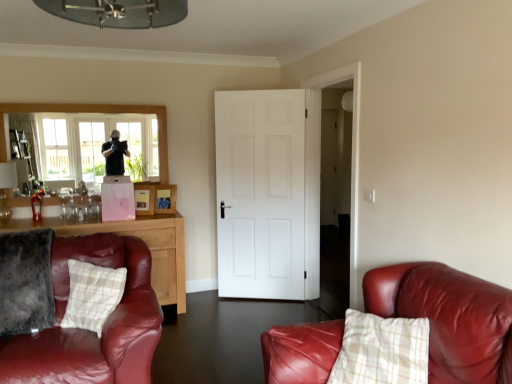
Question: Choose the correct answer: Is velvety gray pillow at lower left, the first pillow from the left, inside matte brown cabinet at left or outside it?

Choices:
 (A) inside
 (B) outside

Answer: (B)

Question: From their relative heights in the image, would you say velvety gray pillow at lower left, marked as the 2th pillow in a right-to-left arrangement, is taller or shorter than matte brown cabinet at left?

Choices:
 (A) tall
 (B) short

Answer: (B)

Question: Which is farther from the clear glass window at upper left?

Choices:
 (A) white matte door at center
 (B) velvety gray pillow at lower left, the first pillow from the left
 (C) matte brown cabinet at left
 (D) leather couch at right
 (E) plaid fabric pillow at lower left, the 2th pillow from the left

Answer: (D)

Question: Estimate the real-world distances between objects in this image. Which object is farther from the matte brown cabinet at left?

Choices:
 (A) leather couch at right
 (B) white matte door at center
 (C) plaid fabric pillow at lower left, the 2th pillow from the left
 (D) velvety gray pillow at lower left, marked as the 2th pillow in a right-to-left arrangement
 (E) clear glass window at upper left

Answer: (A)